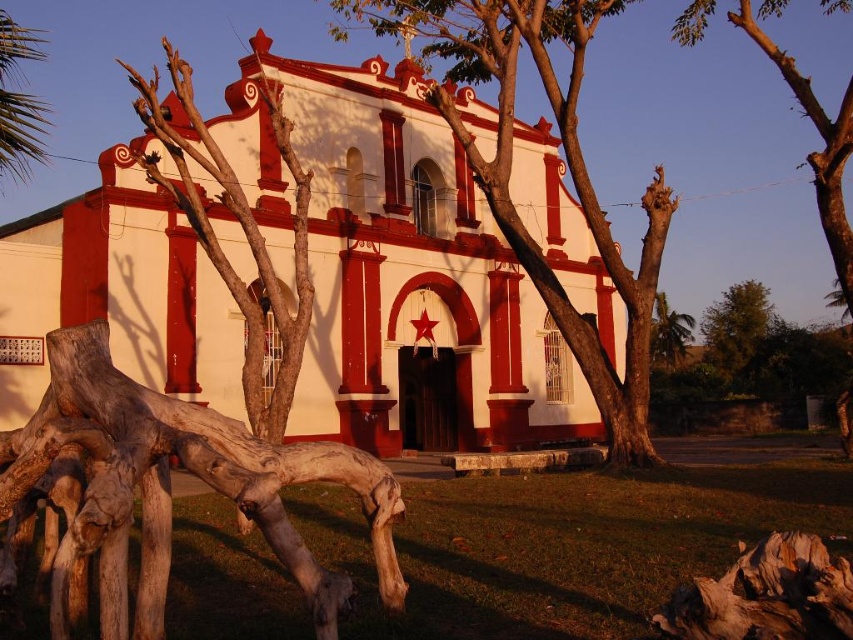
Which is more to the left, smooth bark tree at center or green leafy palm at upper left?

green leafy palm at upper left is more to the left.

The image size is (853, 640). Find the location of `smooth bark tree at center`. smooth bark tree at center is located at coordinates (566, 164).

Is white painted stucco church at center shorter than green leafy palm at upper left?

Yes.

Does white painted stucco church at center have a larger size compared to green leafy palm at upper left?

No.

At what (x,y) coordinates should I click in order to perform the action: click on white painted stucco church at center. Please return your answer as a coordinate pair (x, y). The width and height of the screenshot is (853, 640). Looking at the image, I should click on (413, 280).

Is point (12, 132) farther from viewer compared to point (672, 308)?

No, (12, 132) is closer to viewer.

Between green leafy palm at upper left and green leafy palm tree at center, which one is positioned lower?

green leafy palm tree at center

This screenshot has width=853, height=640. I want to click on green leafy palm at upper left, so click(19, 100).